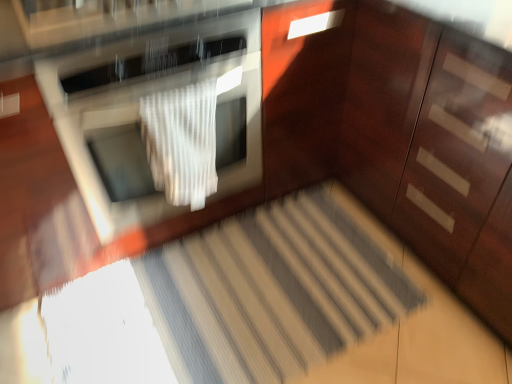
The image size is (512, 384). Identify the location of striped carpet at center. (275, 292).

Consider the image. Measure the distance between point (474, 157) and camera.

Point (474, 157) is 3.62 feet away from camera.

Image resolution: width=512 pixels, height=384 pixels. What do you see at coordinates (145, 113) in the screenshot?
I see `satin silver oven at center` at bounding box center [145, 113].

What is the approximate height of satin silver oven at center?

32.47 inches.

Identify the location of white textured blanket at center. The height and width of the screenshot is (384, 512). (182, 142).

Does point (162, 151) come in front of point (265, 31)?

That is True.

Choose the correct answer: Is white textured blanket at center inside glossy wood dresser at right or outside it?

white textured blanket at center is not enclosed by glossy wood dresser at right.

In the scene shown: Is the surface of white textured blanket at center in direct contact with glossy wood dresser at right?

No, white textured blanket at center is not touching glossy wood dresser at right.

Is striped carpet at center with satin silver oven at center?

No, striped carpet at center is not next to satin silver oven at center.

In terms of size, does striped carpet at center appear bigger or smaller than satin silver oven at center?

striped carpet at center is smaller than satin silver oven at center.

From the image's perspective, would you say striped carpet at center is shown under satin silver oven at center?

Yes, from the image's perspective, striped carpet at center is below satin silver oven at center.

Can you tell me how much striped carpet at center and satin silver oven at center differ in facing direction?

0.0922 degrees separate the facing orientations of striped carpet at center and satin silver oven at center.

From a real-world perspective, who is located lower, satin silver oven at center or striped carpet at center?

In real-world perspective, striped carpet at center is lower.

Is satin silver oven at center not close to striped carpet at center?

No, satin silver oven at center is not far from striped carpet at center.

Considering the sizes of objects satin silver oven at center and striped carpet at center in the image provided, who is shorter, satin silver oven at center or striped carpet at center?

Standing shorter between the two is striped carpet at center.

Choose the correct answer: Is satin silver oven at center inside striped carpet at center or outside it?

The correct answer is: outside.

Is white textured blanket at center directly adjacent to satin silver oven at center?

Yes, the surface of white textured blanket at center is in contact with satin silver oven at center.

From the picture: From the image's perspective, is white textured blanket at center below satin silver oven at center?

Correct, white textured blanket at center appears lower than satin silver oven at center in the image.

In terms of size, does white textured blanket at center appear bigger or smaller than satin silver oven at center?

Clearly, white textured blanket at center is smaller in size than satin silver oven at center.

You are a GUI agent. You are given a task and a screenshot of the screen. Output one action in this format:
    pyautogui.click(x=<x>, y=<y>)
    Task: Click on the blanket lying above the striped carpet at center (from the image's perspective)
    Image resolution: width=512 pixels, height=384 pixels.
    Given the screenshot: What is the action you would take?
    pyautogui.click(x=182, y=142)

Would you say white textured blanket at center is a long distance from striped carpet at center?

That's not correct — white textured blanket at center is a little close to striped carpet at center.

Which object is positioned more to the left, white textured blanket at center or striped carpet at center?

white textured blanket at center.

Is white textured blanket at center oriented towards striped carpet at center?

No, white textured blanket at center is not oriented towards striped carpet at center.

Which object is further away from the camera, glossy wood dresser at right or satin silver oven at center?

satin silver oven at center is behind.

Considering the positions of objects glossy wood dresser at right and satin silver oven at center in the image provided, who is more to the left, glossy wood dresser at right or satin silver oven at center?

Answer: satin silver oven at center is more to the left.

From the image's perspective, is glossy wood dresser at right above or below satin silver oven at center?

glossy wood dresser at right is situated lower than satin silver oven at center in the image.

Does glossy wood dresser at right have a smaller size compared to satin silver oven at center?

No, glossy wood dresser at right is not smaller than satin silver oven at center.

From a real-world perspective, is striped carpet at center located beneath white textured blanket at center?

Yes.

Between striped carpet at center and white textured blanket at center, which one appears on the right side from the viewer's perspective?

striped carpet at center is more to the right.

Is there a large distance between striped carpet at center and white textured blanket at center?

Actually, striped carpet at center and white textured blanket at center are a little close together.

Which object is further away from the camera, striped carpet at center or white textured blanket at center?

striped carpet at center is further away from the camera.

Locate an element on the screen. dresser that appears in front of the white textured blanket at center is located at coordinates (400, 135).

In order to click on oven above the striped carpet at center (from the image's perspective) in this screenshot , I will do `click(145, 113)`.

Estimate the real-world distances between objects in this image. Which object is further from glossy wood dresser at right, satin silver oven at center or white textured blanket at center?

white textured blanket at center is further to glossy wood dresser at right.

Looking at the image, which one is located further to white textured blanket at center, striped carpet at center or glossy wood dresser at right?

striped carpet at center lies further to white textured blanket at center than the other object.

Looking at the image, which one is located further to glossy wood dresser at right, white textured blanket at center or satin silver oven at center?

The object further to glossy wood dresser at right is white textured blanket at center.

Looking at the image, which one is located further to glossy wood dresser at right, satin silver oven at center or striped carpet at center?

Based on the image, striped carpet at center appears to be further to glossy wood dresser at right.

Based on their spatial positions, is glossy wood dresser at right or satin silver oven at center further from striped carpet at center?

satin silver oven at center is further to striped carpet at center.

Based on their spatial positions, is satin silver oven at center or striped carpet at center closer to white textured blanket at center?

Based on the image, satin silver oven at center appears to be nearer to white textured blanket at center.

When comparing their distances from striped carpet at center, does glossy wood dresser at right or white textured blanket at center seem closer?

The object closer to striped carpet at center is glossy wood dresser at right.

Based on their spatial positions, is white textured blanket at center or satin silver oven at center further from striped carpet at center?

white textured blanket at center is positioned further to the anchor striped carpet at center.

Identify the location of blanket located between satin silver oven at center and glossy wood dresser at right in the left-right direction. This screenshot has width=512, height=384. (182, 142).

This screenshot has width=512, height=384. Identify the location of blanket between satin silver oven at center and striped carpet at center in the up-down direction. (182, 142).

Identify the location of stair between white textured blanket at center and glossy wood dresser at right from left to right. (275, 292).

Image resolution: width=512 pixels, height=384 pixels. I want to click on stair located between satin silver oven at center and glossy wood dresser at right in the left-right direction, so click(x=275, y=292).